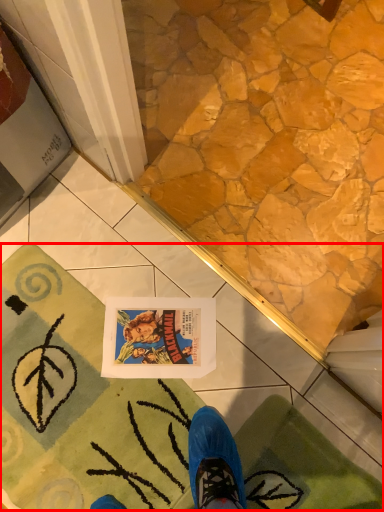
Question: From the image's perspective, where is bath mat (annotated by the red box) located relative to bath mat?

Choices:
 (A) below
 (B) above

Answer: (B)